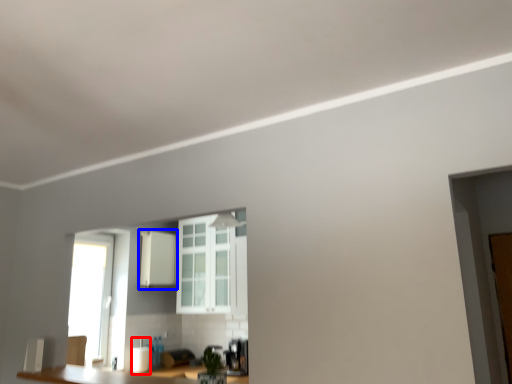
Question: Which object appears farthest to the camera in this image, appliance (highlighted by a red box) or cabinetry (highlighted by a blue box)?

Choices:
 (A) appliance
 (B) cabinetry

Answer: (B)